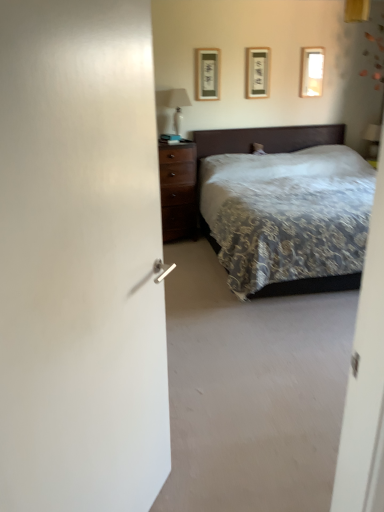
Question: Is matte glass picture frame at upper right, the 1th picture frame when ordered from right to left, situated inside white glossy table lamp at upper center, placed as the second table lamp when sorted from right to left, or outside?

Choices:
 (A) outside
 (B) inside

Answer: (A)

Question: From a real-world perspective, is matte glass picture frame at upper right, the 3th picture frame positioned from the left, above or below white glossy table lamp at upper center, acting as the 1th table lamp starting from the front?

Choices:
 (A) above
 (B) below

Answer: (A)

Question: Estimate the real-world distances between objects in this image. Which object is closer to the patterned fabric bed at center?

Choices:
 (A) matte white plastic table lamp at upper right, acting as the 1th table lamp starting from the right
 (B) white glossy table lamp at upper center, acting as the 1th table lamp starting from the front
 (C) matte wooden picture frame at upper center, the second picture frame viewed from the right
 (D) matte black picture frame at upper center, arranged as the first picture frame when viewed from the left
 (E) matte glass picture frame at upper right, the 3th picture frame positioned from the left

Answer: (C)

Question: Which is nearer to the matte glass picture frame at upper right, the 1th picture frame when ordered from right to left?

Choices:
 (A) patterned fabric bed at center
 (B) white glossy table lamp at upper center, the 2th table lamp in the back-to-front sequence
 (C) matte black picture frame at upper center, which appears as the 3th picture frame when viewed from the right
 (D) matte white plastic table lamp at upper right, acting as the 1th table lamp starting from the right
 (E) matte wooden picture frame at upper center, which appears as the second picture frame when viewed from the left

Answer: (E)